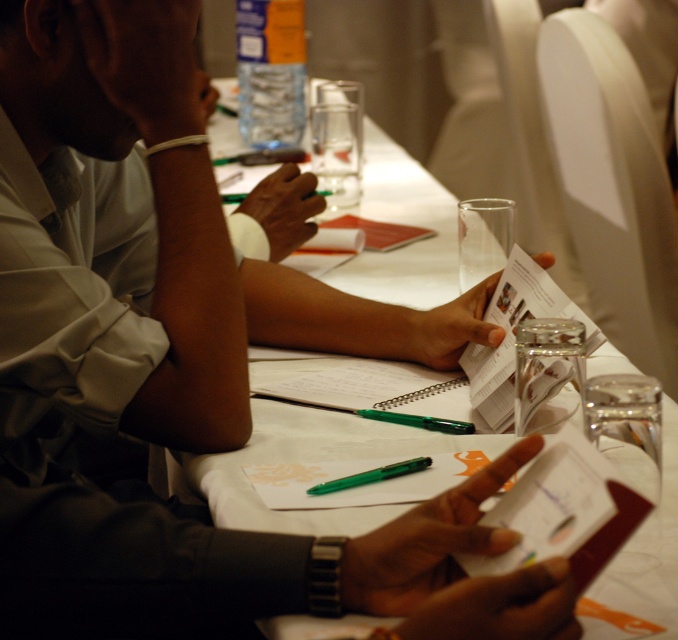
In the scene shown: Which is more to the right, matte paper notepad at center or spiral notebook at center?

spiral notebook at center

Is matte paper notepad at center above spiral notebook at center?

Indeed, matte paper notepad at center is positioned over spiral notebook at center.

Does point (339, 227) lie behind point (464, 380)?

Yes, point (339, 227) is behind point (464, 380).

This screenshot has height=640, width=678. I want to click on matte paper notepad at center, so click(378, 230).

Between green plastic pen at center and spiral notebook at center, which one appears on the right side from the viewer's perspective?

spiral notebook at center

Does green plastic pen at center have a larger size compared to spiral notebook at center?

Actually, green plastic pen at center might be smaller than spiral notebook at center.

This screenshot has height=640, width=678. What do you see at coordinates (372, 476) in the screenshot?
I see `green plastic pen at center` at bounding box center [372, 476].

Find the location of a particular element. This screenshot has width=678, height=640. green plastic pen at center is located at coordinates (372, 476).

In the scene shown: Does white paper at center have a smaller size compared to spiral notebook at center?

No, white paper at center is not smaller than spiral notebook at center.

What do you see at coordinates (300, 460) in the screenshot?
I see `white paper at center` at bounding box center [300, 460].

Between point (176, 483) and point (418, 394), which one is positioned in front?

Point (176, 483) is in front.

You are a GUI agent. You are given a task and a screenshot of the screen. Output one action in this format:
    pyautogui.click(x=<x>, y=<y>)
    Task: Click on the white paper at center
    This screenshot has height=640, width=678.
    Given the screenshot: What is the action you would take?
    pyautogui.click(x=300, y=460)